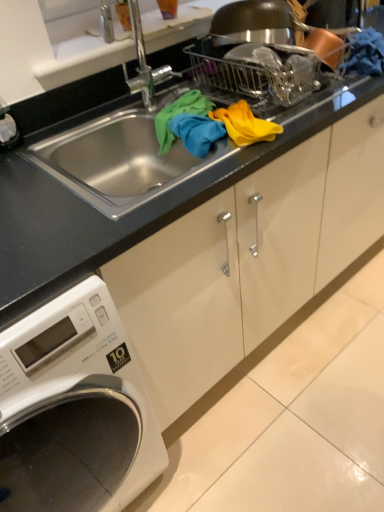
What is the approximate height of yellow fabric at upper center?

2.51 inches.

Where is `white glossy washing machine at lower left`? This screenshot has width=384, height=512. white glossy washing machine at lower left is located at coordinates (74, 408).

From a real-world perspective, between black granite countertop at center and white glossy washing machine at lower left, who is vertically lower?

white glossy washing machine at lower left is physically lower.

Can we say black granite countertop at center lies outside white glossy washing machine at lower left?

Yes, black granite countertop at center is outside of white glossy washing machine at lower left.

Considering the relative positions of black granite countertop at center and white glossy washing machine at lower left in the image provided, is black granite countertop at center to the right of white glossy washing machine at lower left from the viewer's perspective?

Yes.

How much distance is there between black granite countertop at center and white glossy washing machine at lower left?

black granite countertop at center is 17.53 inches from white glossy washing machine at lower left.

Find the location of a particular element. The height and width of the screenshot is (512, 384). countertop that is above the white glossy washing machine at lower left (from the image's perspective) is located at coordinates (126, 188).

Visually, is white glossy washing machine at lower left positioned to the left or to the right of black granite countertop at center?

Based on their positions, white glossy washing machine at lower left is located to the left of black granite countertop at center.

Which is less distant, (x=125, y=462) or (x=362, y=99)?

The point (x=125, y=462) is closer to the camera.

Is yellow fabric at upper center positioned far away from white glossy washing machine at lower left?

No, there isn't a large distance between yellow fabric at upper center and white glossy washing machine at lower left.

Is yellow fabric at upper center positioned beyond the bounds of white glossy washing machine at lower left?

Yes, yellow fabric at upper center is located beyond the bounds of white glossy washing machine at lower left.

Which object is wider, yellow fabric at upper center or white glossy washing machine at lower left?

white glossy washing machine at lower left is wider.

Does point (264, 137) come closer to viewer compared to point (56, 454)?

Yes, point (264, 137) is closer to viewer.

Is black granite countertop at center thinner than yellow fabric at upper center?

In fact, black granite countertop at center might be wider than yellow fabric at upper center.

Can you tell me how much black granite countertop at center and yellow fabric at upper center differ in facing direction?

They differ by 55.7 degrees in their facing directions.

Could you tell me if black granite countertop at center is turned towards yellow fabric at upper center?

Yes, black granite countertop at center is turned towards yellow fabric at upper center.

Visually, is black granite countertop at center positioned to the left or to the right of yellow fabric at upper center?

black granite countertop at center is to the left of yellow fabric at upper center.

Is yellow fabric at upper center placed right next to black granite countertop at center?

No, yellow fabric at upper center is not with black granite countertop at center.

Identify the location of material behind the black granite countertop at center. pos(245,124).

Does yellow fabric at upper center have a greater width compared to black granite countertop at center?

Incorrect, the width of yellow fabric at upper center does not surpass that of black granite countertop at center.

From a real-world perspective, which is physically below, yellow fabric at upper center or black granite countertop at center?

yellow fabric at upper center is physically lower.

Looking at their sizes, would you say white glossy washing machine at lower left is wider or thinner than yellow fabric at upper center?

In the image, white glossy washing machine at lower left appears to be wider than yellow fabric at upper center.

From a real-world perspective, relative to yellow fabric at upper center, is white glossy washing machine at lower left vertically above or below?

white glossy washing machine at lower left is below yellow fabric at upper center.

Find the location of `material above the white glossy washing machine at lower left (from a real-world perspective)`. material above the white glossy washing machine at lower left (from a real-world perspective) is located at coordinates (245, 124).

Does white glossy washing machine at lower left turn towards yellow fabric at upper center?

No, white glossy washing machine at lower left does not turn towards yellow fabric at upper center.

The width and height of the screenshot is (384, 512). Identify the location of washing machine below the black granite countertop at center (from a real-world perspective). (74, 408).

The width and height of the screenshot is (384, 512). Identify the location of countertop behind the white glossy washing machine at lower left. [126, 188].

Which object lies further to the anchor point yellow fabric at upper center, black granite countertop at center or white glossy washing machine at lower left?

The object further to yellow fabric at upper center is white glossy washing machine at lower left.

Looking at this image, looking at the image, which one is located further to black granite countertop at center, white glossy washing machine at lower left or yellow fabric at upper center?

white glossy washing machine at lower left is further to black granite countertop at center.

When comparing their distances from white glossy washing machine at lower left, does black granite countertop at center or yellow fabric at upper center seem closer?

Based on the image, black granite countertop at center appears to be nearer to white glossy washing machine at lower left.

From the image, which object appears to be nearer to black granite countertop at center, yellow fabric at upper center or white glossy washing machine at lower left?

yellow fabric at upper center.

Considering their positions, is white glossy washing machine at lower left positioned closer to yellow fabric at upper center than black granite countertop at center?

The object closer to yellow fabric at upper center is black granite countertop at center.

When comparing their distances from white glossy washing machine at lower left, does yellow fabric at upper center or black granite countertop at center seem closer?

black granite countertop at center is positioned closer to the anchor white glossy washing machine at lower left.

Find the location of a particular element. The image size is (384, 512). material between black granite countertop at center and white glossy washing machine at lower left from top to bottom is located at coordinates (245, 124).